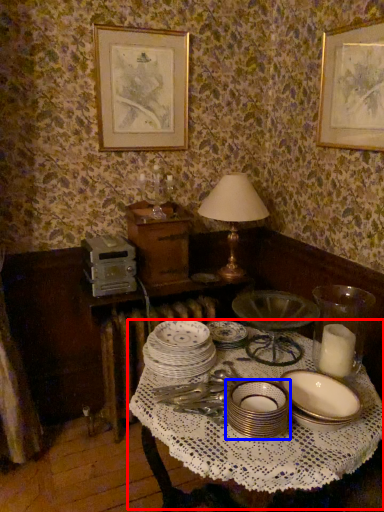
Question: Which point is further to the camera, round table (highlighted by a red box) or tableware (highlighted by a blue box)?

Choices:
 (A) round table
 (B) tableware

Answer: (B)